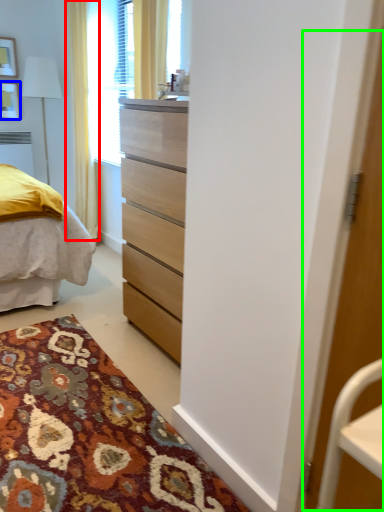
Question: Considering the real-world distances, which object is farthest from curtain (highlighted by a red box)? picture frame (highlighted by a blue box) or screen door (highlighted by a green box)?

Choices:
 (A) picture frame
 (B) screen door

Answer: (B)